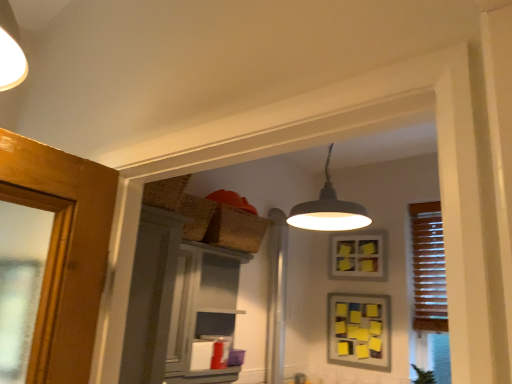
What is the approximate height of matte gray screen door at left?

matte gray screen door at left is 60.49 centimeters tall.

Find the location of `yellow paper picture frame at center, the second picture frame from the top`. yellow paper picture frame at center, the second picture frame from the top is located at coordinates (359, 330).

Measure the distance between green leafy plant at lower right and camera.

green leafy plant at lower right and camera are 8.67 feet apart from each other.

Locate an element on the screen. white glossy cabinet at upper center is located at coordinates (203, 313).

Which is in front, point (260, 218) or point (125, 350)?

Positioned in front is point (125, 350).

Considering the relative positions of woven brown basket at upper center and matte gray screen door at left in the image provided, is woven brown basket at upper center in front of matte gray screen door at left?

No, woven brown basket at upper center is further to the viewer.

Is woven brown basket at upper center facing towards matte gray screen door at left?

No, woven brown basket at upper center is not turned towards matte gray screen door at left.

Is wooden blinds at right taller or shorter than yellow paper picture frame at center, the second picture frame from the top?

Clearly, wooden blinds at right is taller compared to yellow paper picture frame at center, the second picture frame from the top.

Is wooden blinds at right not near yellow paper picture frame at center, the first picture frame ordered from the bottom?

No, wooden blinds at right is in close proximity to yellow paper picture frame at center, the first picture frame ordered from the bottom.

Is yellow paper picture frame at center, the first picture frame ordered from the bottom, located within wooden blinds at right?

No, yellow paper picture frame at center, the first picture frame ordered from the bottom, is not a part of wooden blinds at right.

Who is more distant, wooden blinds at right or yellow paper picture frame at center, the first picture frame ordered from the bottom?

yellow paper picture frame at center, the first picture frame ordered from the bottom, is more distant.

Who is shorter, yellow paper picture frame at center, the second picture frame from the top, or wooden blinds at right?

Standing shorter between the two is yellow paper picture frame at center, the second picture frame from the top.

Considering the positions of points (338, 332) and (419, 203), is point (338, 332) closer to camera compared to point (419, 203)?

No, (338, 332) is further to viewer.

Which object is thinner, yellow paper picture frame at center, the first picture frame ordered from the bottom, or wooden blinds at right?

yellow paper picture frame at center, the first picture frame ordered from the bottom, is thinner.

Are yellow paper picture frame at center, the first picture frame ordered from the bottom, and wooden blinds at right located far from each other?

No, yellow paper picture frame at center, the first picture frame ordered from the bottom, is in close proximity to wooden blinds at right.

Is woven brown basket at upper center surrounded by matte gray screen door at left?

No.

Which is nearer, (148, 282) or (218, 225)?

Point (148, 282) appears to be closer to the viewer than point (218, 225).

In the image, there is a matte gray screen door at left. What are the coordinates of `basket above it (from the image's perspective)` in the screenshot? It's located at (236, 229).

In the scene shown: From the image's perspective, would you say white glossy cabinet at upper center is positioned over wooden blinds at right?

No, from the image's perspective, white glossy cabinet at upper center is not above wooden blinds at right.

Is white glossy cabinet at upper center to the left or to the right of wooden blinds at right in the image?

Based on their positions, white glossy cabinet at upper center is located to the left of wooden blinds at right.

At what (x,y) coordinates should I click in order to perform the action: click on cabinetry that appears in front of the wooden blinds at right. Please return your answer as a coordinate pair (x, y). The image size is (512, 384). Looking at the image, I should click on (203, 313).

Considering the sizes of objects green leafy plant at lower right and yellow sticky notes at upper center, the 2th picture frame in the bottom-to-top sequence, in the image provided, who is shorter, green leafy plant at lower right or yellow sticky notes at upper center, the 2th picture frame in the bottom-to-top sequence,?

With less height is green leafy plant at lower right.

Based on the photo, from a real-world perspective, is green leafy plant at lower right physically above yellow sticky notes at upper center, the 2th picture frame in the bottom-to-top sequence?

No.

Is the depth of green leafy plant at lower right less than that of yellow sticky notes at upper center, the 2th picture frame in the bottom-to-top sequence?

Yes, green leafy plant at lower right is in front of yellow sticky notes at upper center, the 2th picture frame in the bottom-to-top sequence.

Which point is more distant from viewer, (419, 377) or (330, 257)?

The point (330, 257) is behind.

Is wooden blinds at right to the right of green leafy plant at lower right from the viewer's perspective?

Yes.

In the image, there is a wooden blinds at right. Find the location of `plant below it (from the image's perspective)`. plant below it (from the image's perspective) is located at coordinates (423, 376).

Would you say wooden blinds at right is a long distance from green leafy plant at lower right?

No, there isn't a large distance between wooden blinds at right and green leafy plant at lower right.

Identify the location of screen door below the woven brown basket at upper center (from the image's perspective). (151, 297).

The image size is (512, 384). In order to click on window above the yellow paper picture frame at center, the second picture frame from the top (from a real-world perspective) in this screenshot , I will do `click(428, 268)`.

Which object lies further to the anchor point white glossy cabinet at upper center, matte gray screen door at left or yellow paper picture frame at center, the second picture frame from the top?

yellow paper picture frame at center, the second picture frame from the top.

Considering their positions, is green leafy plant at lower right positioned closer to yellow sticky notes at upper center, the 1th picture frame in the top-to-bottom sequence, than yellow paper picture frame at center, the second picture frame from the top?

yellow paper picture frame at center, the second picture frame from the top, is closer to yellow sticky notes at upper center, the 1th picture frame in the top-to-bottom sequence.

When comparing their distances from woven brown basket at upper center, does matte gray screen door at left or yellow paper picture frame at center, the first picture frame ordered from the bottom, seem closer?

The object closer to woven brown basket at upper center is matte gray screen door at left.

Looking at the image, which one is located closer to matte gray screen door at left, white glossy cabinet at upper center or yellow sticky notes at upper center, the 2th picture frame in the bottom-to-top sequence?

white glossy cabinet at upper center is closer to matte gray screen door at left.

Considering their positions, is yellow sticky notes at upper center, the 1th picture frame in the top-to-bottom sequence, positioned closer to wooden blinds at right than white glossy cabinet at upper center?

yellow sticky notes at upper center, the 1th picture frame in the top-to-bottom sequence, is positioned closer to the anchor wooden blinds at right.

From the image, which object appears to be nearer to white glossy cabinet at upper center, yellow sticky notes at upper center, the 2th picture frame in the bottom-to-top sequence, or matte gray screen door at left?

Among the two, matte gray screen door at left is located nearer to white glossy cabinet at upper center.

Estimate the real-world distances between objects in this image. Which object is further from yellow paper picture frame at center, the first picture frame ordered from the bottom, white glossy cabinet at upper center or wooden blinds at right?

The object further to yellow paper picture frame at center, the first picture frame ordered from the bottom, is white glossy cabinet at upper center.

From the image, which object appears to be farther from white glossy cabinet at upper center, matte gray screen door at left or yellow sticky notes at upper center, the 2th picture frame in the bottom-to-top sequence?

yellow sticky notes at upper center, the 2th picture frame in the bottom-to-top sequence.

Identify the location of cabinetry between matte gray screen door at left and green leafy plant at lower right. (203, 313).

Identify the location of picture frame situated between woven brown basket at upper center and yellow sticky notes at upper center, the 1th picture frame in the top-to-bottom sequence, from left to right. (359, 330).

You are a GUI agent. You are given a task and a screenshot of the screen. Output one action in this format:
    pyautogui.click(x=<x>, y=<y>)
    Task: Click on the cabinetry between matte gray screen door at left and wooden blinds at right from left to right
    The width and height of the screenshot is (512, 384).
    Given the screenshot: What is the action you would take?
    pyautogui.click(x=203, y=313)

Locate an element on the screen. picture frame between yellow paper picture frame at center, the second picture frame from the top, and wooden blinds at right from left to right is located at coordinates (358, 256).